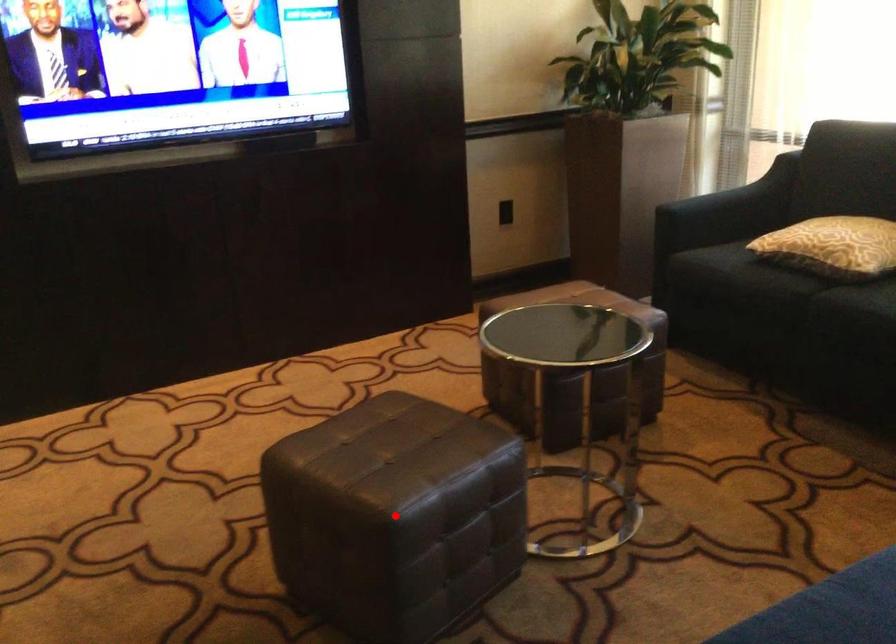
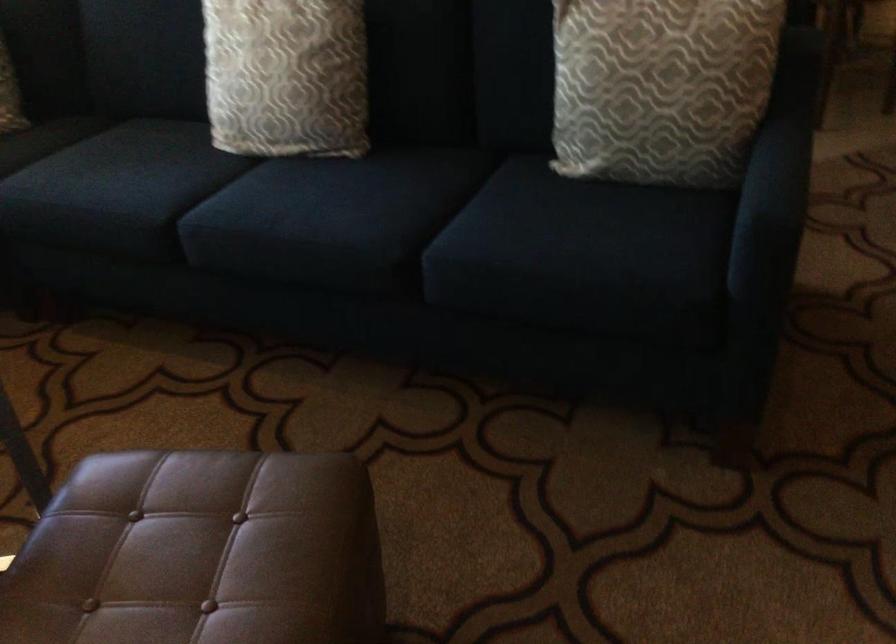
Where in the second image is the point corresponding to the highlighted location from the first image?

(341, 444)